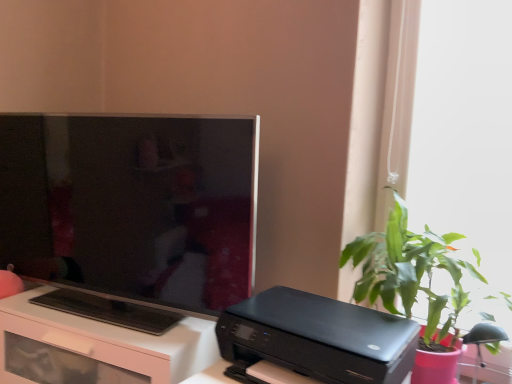
What do you see at coordinates (131, 213) in the screenshot? This screenshot has height=384, width=512. I see `matte black tv at left` at bounding box center [131, 213].

I want to click on matte black tv at left, so click(131, 213).

Which is in front, point (296, 309) or point (35, 336)?

The point (296, 309) is closer.

Between black glossy printer at lower center and white glossy desk at lower left, which one appears on the left side from the viewer's perspective?

Positioned to the left is white glossy desk at lower left.

From a real-world perspective, is black glossy printer at lower center physically located above or below white glossy desk at lower left?

black glossy printer at lower center is above white glossy desk at lower left.

Is black glossy printer at lower center behind white glossy desk at lower left?

No.

Is matte black tv at left completely or partially outside of white glossy desk at lower left?

Absolutely, matte black tv at left is external to white glossy desk at lower left.

From a real-world perspective, which object stands above the other?

matte black tv at left.

Does matte black tv at left appear on the left side of white glossy desk at lower left?

Incorrect, matte black tv at left is not on the left side of white glossy desk at lower left.

Can you confirm if matte black tv at left is thinner than white glossy desk at lower left?

Yes.

Considering the positions of point (418, 243) and point (179, 267), is point (418, 243) closer or farther from the camera than point (179, 267)?

Point (418, 243).

In the image, there is a green leafy plant at right. Where is `television above it (from the image's perspective)`? The height and width of the screenshot is (384, 512). television above it (from the image's perspective) is located at coordinates (131, 213).

In the scene shown: Are green leafy plant at right and matte black tv at left making contact?

No, green leafy plant at right is not making contact with matte black tv at left.

Is green leafy plant at right wider than matte black tv at left?

Indeed, green leafy plant at right has a greater width compared to matte black tv at left.

Is matte black tv at left smaller than green leafy plant at right?

No, matte black tv at left is not smaller than green leafy plant at right.

Which object is wider, matte black tv at left or green leafy plant at right?

green leafy plant at right is wider.

From their relative heights in the image, would you say matte black tv at left is taller or shorter than green leafy plant at right?

Clearly, matte black tv at left is taller compared to green leafy plant at right.

In the scene shown: From the image's perspective, is matte black tv at left above or below green leafy plant at right?

matte black tv at left is above green leafy plant at right.

How much distance is there between green leafy plant at right and black glossy printer at lower center?

The distance of green leafy plant at right from black glossy printer at lower center is 9.30 inches.

This screenshot has width=512, height=384. Identify the location of houseplant above the black glossy printer at lower center (from the image's perspective). (411, 271).

Between green leafy plant at right and black glossy printer at lower center, which one has more height?

With more height is green leafy plant at right.

Which of these two, green leafy plant at right or black glossy printer at lower center, is thinner?

Thinner between the two is green leafy plant at right.

Looking at this image, considering the sizes of objects white glossy desk at lower left and black glossy printer at lower center in the image provided, who is shorter, white glossy desk at lower left or black glossy printer at lower center?

With less height is black glossy printer at lower center.

At what (x,y) coordinates should I click in order to perform the action: click on desk below the black glossy printer at lower center (from a real-world perspective). Please return your answer as a coordinate pair (x, y). The width and height of the screenshot is (512, 384). Looking at the image, I should click on (95, 347).

From the image's perspective, is white glossy desk at lower left located beneath black glossy printer at lower center?

Correct, white glossy desk at lower left appears lower than black glossy printer at lower center in the image.

Between white glossy desk at lower left and green leafy plant at right, which one is positioned in front?

green leafy plant at right is more forward.

This screenshot has height=384, width=512. In order to click on houseplant above the white glossy desk at lower left (from the image's perspective) in this screenshot , I will do `click(411, 271)`.

Based on the photo, from a real-world perspective, is white glossy desk at lower left over green leafy plant at right?

No, from a real-world perspective, white glossy desk at lower left is not over green leafy plant at right

The image size is (512, 384). Find the location of `printer located above the white glossy desk at lower left (from the image's perspective)`. printer located above the white glossy desk at lower left (from the image's perspective) is located at coordinates (318, 337).

Find the location of `desk lying on the left of matte black tv at left`. desk lying on the left of matte black tv at left is located at coordinates (95, 347).

Which object lies nearer to the anchor point black glossy printer at lower center, matte black tv at left or white glossy desk at lower left?

The object closer to black glossy printer at lower center is white glossy desk at lower left.

Looking at the image, which one is located further to white glossy desk at lower left, matte black tv at left or black glossy printer at lower center?

black glossy printer at lower center lies further to white glossy desk at lower left than the other object.

Based on their spatial positions, is green leafy plant at right or black glossy printer at lower center closer to matte black tv at left?

The object closer to matte black tv at left is black glossy printer at lower center.

Estimate the real-world distances between objects in this image. Which object is closer to matte black tv at left, green leafy plant at right or white glossy desk at lower left?

white glossy desk at lower left.

In the scene shown: Looking at the image, which one is located closer to white glossy desk at lower left, matte black tv at left or green leafy plant at right?

matte black tv at left is closer to white glossy desk at lower left.

Estimate the real-world distances between objects in this image. Which object is further from green leafy plant at right, white glossy desk at lower left or black glossy printer at lower center?

The object further to green leafy plant at right is white glossy desk at lower left.

From the image, which object appears to be nearer to green leafy plant at right, black glossy printer at lower center or matte black tv at left?

The object closer to green leafy plant at right is black glossy printer at lower center.

Looking at this image, based on their spatial positions, is white glossy desk at lower left or matte black tv at left further from green leafy plant at right?

The object further to green leafy plant at right is white glossy desk at lower left.

Locate an element on the screen. This screenshot has width=512, height=384. television located between white glossy desk at lower left and black glossy printer at lower center in the left-right direction is located at coordinates (131, 213).

Where is `printer located between matte black tv at left and green leafy plant at right in the left-right direction`? The height and width of the screenshot is (384, 512). printer located between matte black tv at left and green leafy plant at right in the left-right direction is located at coordinates (318, 337).

You are a GUI agent. You are given a task and a screenshot of the screen. Output one action in this format:
    pyautogui.click(x=<x>, y=<y>)
    Task: Click on the printer situated between white glossy desk at lower left and green leafy plant at right from left to right
    
    Given the screenshot: What is the action you would take?
    pyautogui.click(x=318, y=337)

The image size is (512, 384). In order to click on television located between white glossy desk at lower left and green leafy plant at right in the left-right direction in this screenshot , I will do `click(131, 213)`.